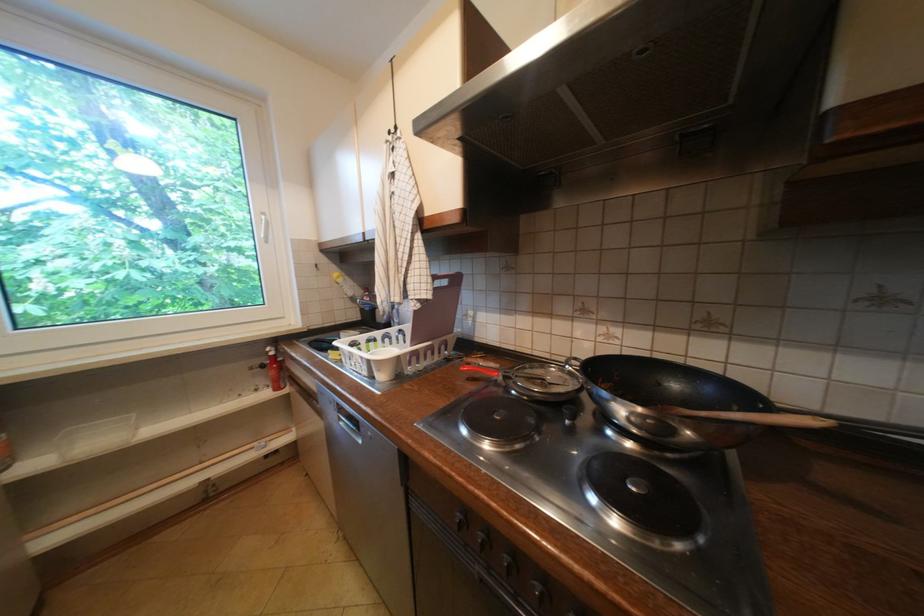
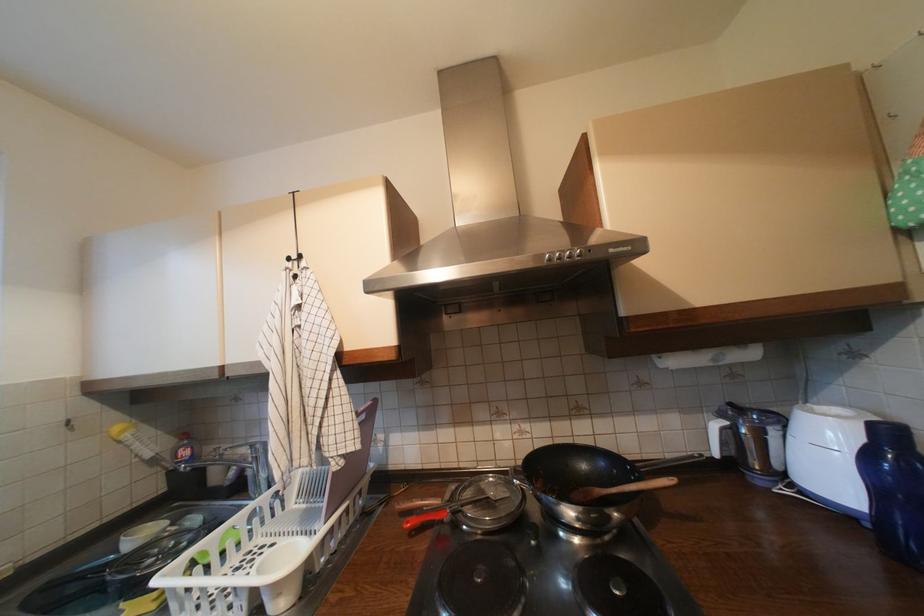
Find the pixel in the second image that matches point (397, 132) in the first image.

(297, 260)